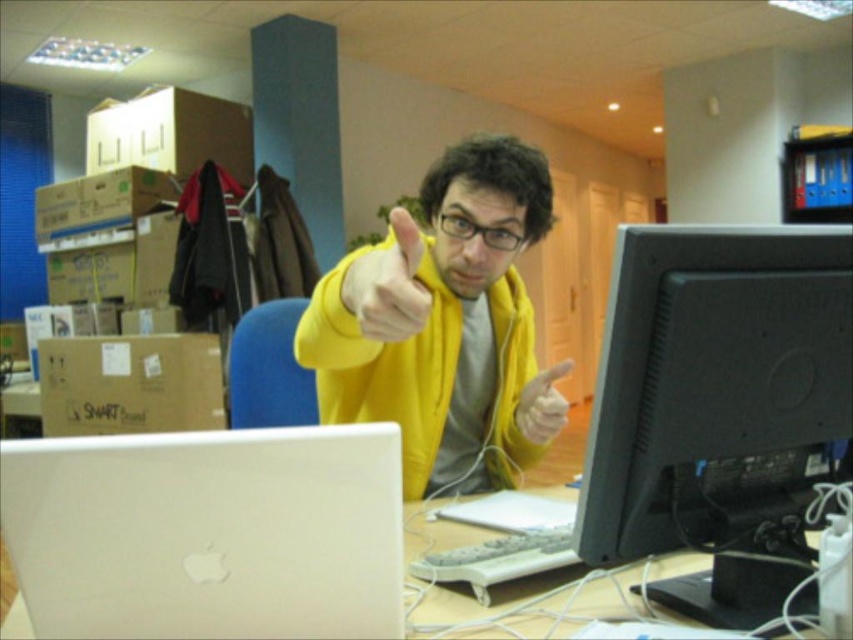
Describe the element at coordinates (718, 408) in the screenshot. The height and width of the screenshot is (640, 853). I see `black matte monitor at right` at that location.

Who is more distant from viewer, [656,300] or [346,502]?

Point [656,300]

Locate an element on the screen. black matte monitor at right is located at coordinates pyautogui.click(x=718, y=408).

Which of these two, satin white laptop at lower left or yellow fabric glove at center, stands taller?

satin white laptop at lower left

Who is positioned more to the right, satin white laptop at lower left or yellow fabric glove at center?

yellow fabric glove at center

What do you see at coordinates (207, 532) in the screenshot? This screenshot has width=853, height=640. I see `satin white laptop at lower left` at bounding box center [207, 532].

Identify the location of satin white laptop at lower left. (207, 532).

Between yellow matte jacket at center and white plastic table at center, which one appears on the left side from the viewer's perspective?

yellow matte jacket at center

Which of these two, yellow matte jacket at center or white plastic table at center, stands shorter?

With less height is white plastic table at center.

In order to click on yellow matte jacket at center in this screenshot , I will do `click(444, 323)`.